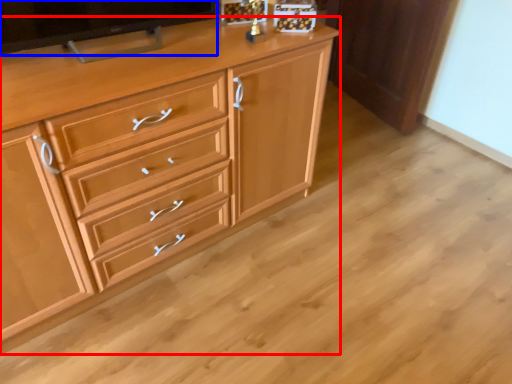
Question: Which object appears closest to the camera in this image, chest of drawers (highlighted by a red box) or television (highlighted by a blue box)?

Choices:
 (A) chest of drawers
 (B) television

Answer: (A)